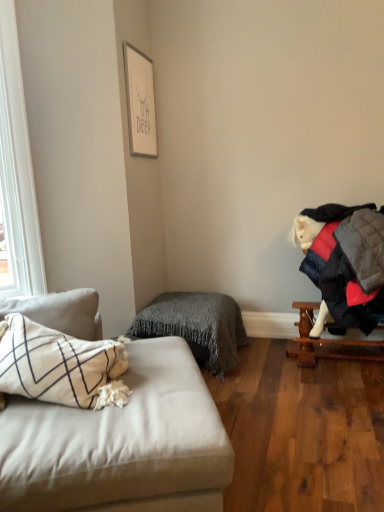
Where is `vacant space in front of wooden table at right`? This screenshot has height=512, width=384. vacant space in front of wooden table at right is located at coordinates (329, 397).